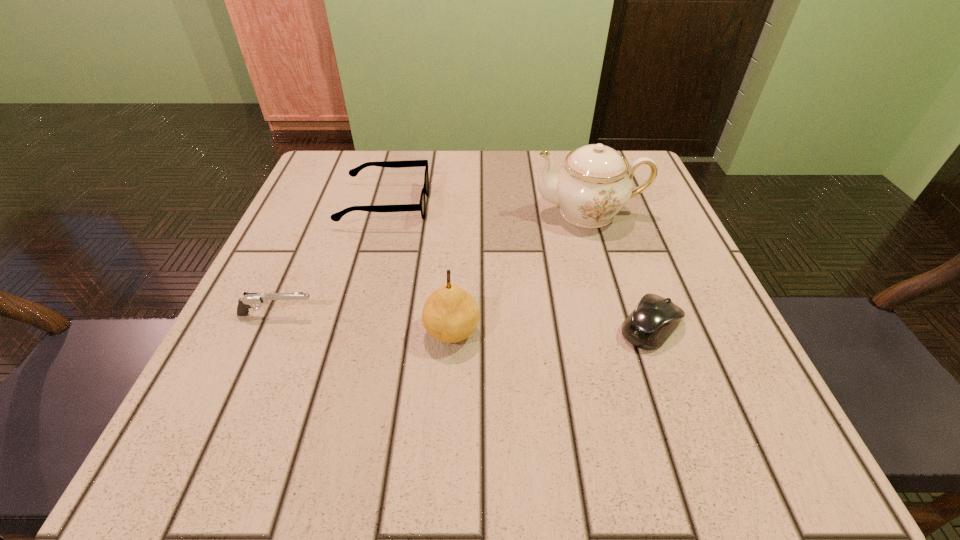
This screenshot has width=960, height=540. In order to click on chinaware in this screenshot , I will do `click(595, 182)`.

This screenshot has height=540, width=960. In order to click on pear in this screenshot , I will do `click(450, 314)`.

What are the coordinates of `the third object from left to right` in the screenshot? It's located at (450, 314).

Identify the location of spectacles. The width and height of the screenshot is (960, 540). (336, 217).

Locate an element on the screen. This screenshot has height=540, width=960. pistol is located at coordinates (249, 299).

At what (x,y) coordinates should I click in order to perform the action: click on mouse. Please return your answer as a coordinate pair (x, y). The width and height of the screenshot is (960, 540). Looking at the image, I should click on (654, 319).

At what (x,y) coordinates should I click in order to perform the action: click on free space located 0.370m at the spout of the tallest object. Please return your answer as a coordinate pair (x, y). This screenshot has height=540, width=960. Looking at the image, I should click on (352, 213).

What are the coordinates of `vacant region located at the spout of the tallest object` in the screenshot? It's located at (485, 213).

Find the location of a particular element. The height and width of the screenshot is (540, 960). free space located 0.350m at the spout of the tallest object is located at coordinates (362, 213).

What are the coordinates of `vacant space located on the back of the fourth shortest object` in the screenshot? It's located at (459, 218).